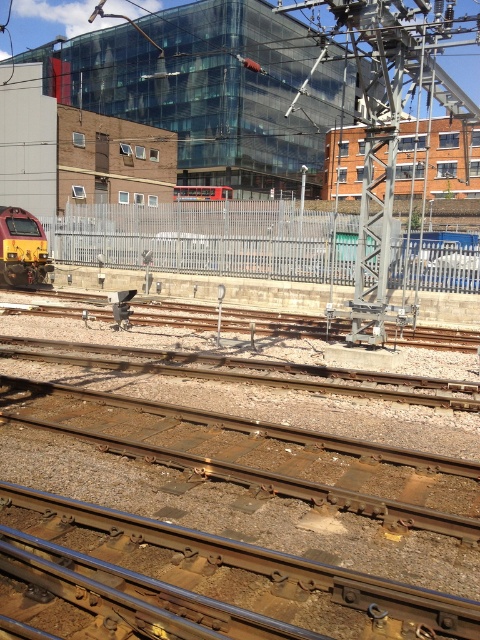
Question: Can you confirm if yellow metallic train at left is bigger than red metallic train at center?

Choices:
 (A) no
 (B) yes

Answer: (A)

Question: Which point is farther to the camera?

Choices:
 (A) metal at center
 (B) red metallic train at center

Answer: (B)

Question: Among these objects, which one is nearest to the camera?

Choices:
 (A) metal at center
 (B) yellow metallic train at left
 (C) red metallic train at center

Answer: (A)

Question: Does metal at center have a lesser width compared to red metallic train at center?

Choices:
 (A) no
 (B) yes

Answer: (B)

Question: Is metal at center smaller than yellow metallic train at left?

Choices:
 (A) yes
 (B) no

Answer: (A)

Question: Which object is the closest to the metal at center?

Choices:
 (A) yellow metallic train at left
 (B) red metallic train at center

Answer: (A)